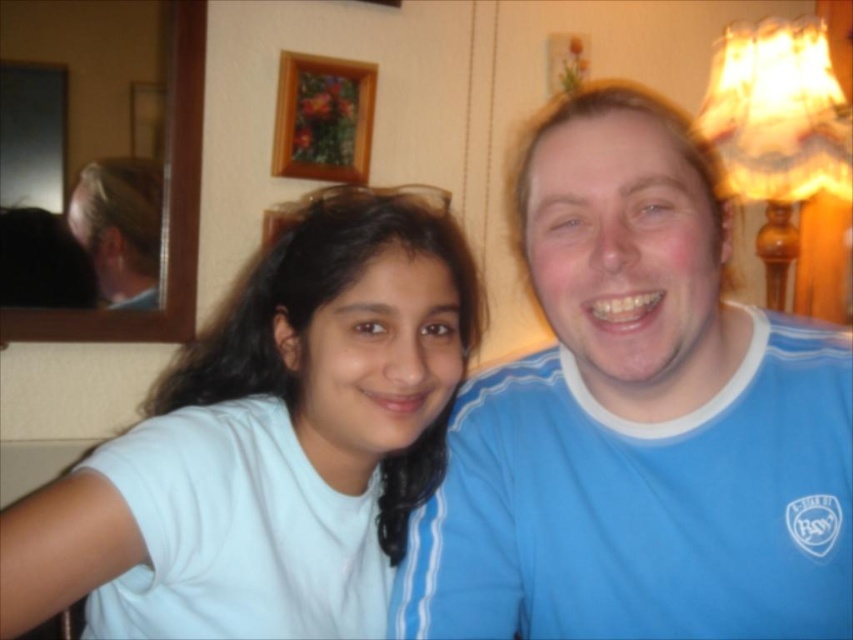
Question: Is wooden picture frame at upper center to the left of blonde hair at left from the viewer's perspective?

Choices:
 (A) yes
 (B) no

Answer: (B)

Question: Which point is closer to the camera?

Choices:
 (A) white matte t-shirt at left
 (B) blonde hair at left

Answer: (A)

Question: Which of the following is the farthest from the observer?

Choices:
 (A) wooden picture frame at upper center
 (B) blonde hair at left

Answer: (A)

Question: Which point is farther to the camera?

Choices:
 (A) (315, 147)
 (B) (286, 244)
 (C) (573, 305)
 (D) (123, 225)

Answer: (A)

Question: Observing the image, what is the correct spatial positioning of blue cotton shirt at right in reference to blonde hair at left?

Choices:
 (A) below
 (B) above

Answer: (A)

Question: Can you confirm if blue cotton shirt at right is wider than wooden picture frame at upper center?

Choices:
 (A) yes
 (B) no

Answer: (A)